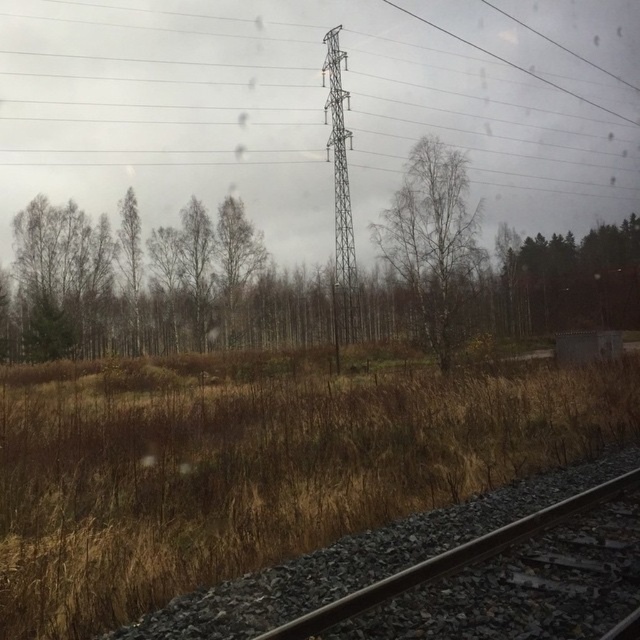
You are a passenger on a moving train and notice the brown leafy trees at center in the middle ground. Based on their position, can you determine if they are closer to the train or further away compared to the foreground railway track?

The brown leafy trees at center are located at point coordinates suggesting they are in the middle ground, which places them further away from the train compared to the foreground railway track.